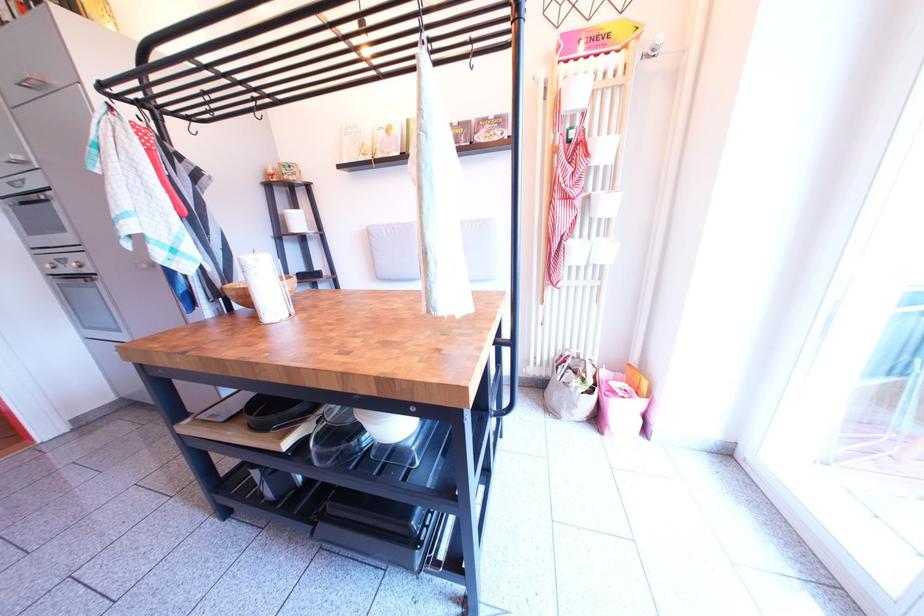
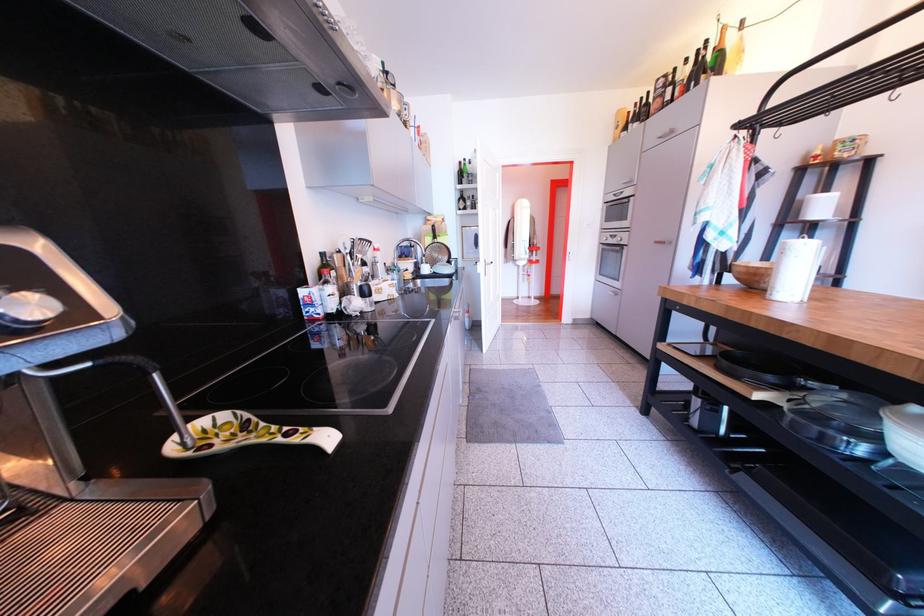
Locate, in the second image, the point that corresponds to point 295,222 in the first image.

(813, 208)